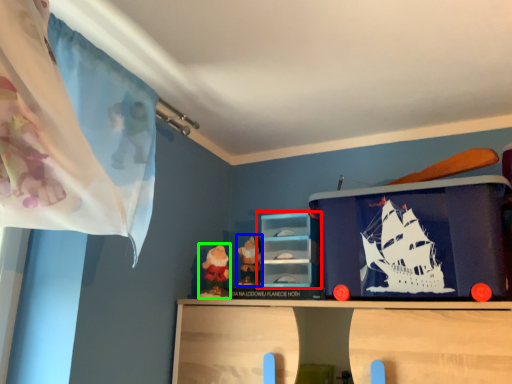
Question: Estimate the real-world distances between objects in this image. Which object is closer to shelf (highlighted by a red box), toy (highlighted by a blue box) or toy (highlighted by a green box)?

Choices:
 (A) toy
 (B) toy

Answer: (A)